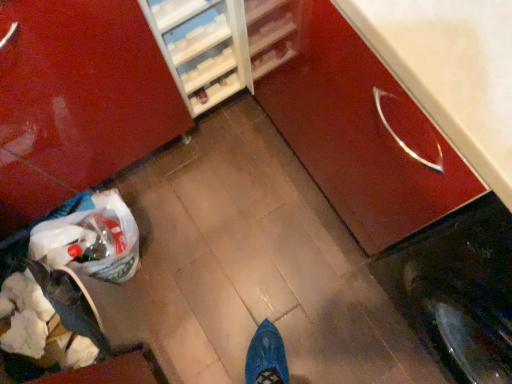
Question: From their relative heights in the image, would you say glossy wood cabinet at lower right, arranged as the first cabinetry when viewed from the left, is taller or shorter than white paper bag at lower left?

Choices:
 (A) tall
 (B) short

Answer: (A)

Question: Looking at their shapes, would you say glossy wood cabinet at lower right, the 2th cabinetry when ordered from right to left, is wider or thinner than white paper bag at lower left?

Choices:
 (A) thin
 (B) wide

Answer: (B)

Question: Which object is the closest to the glossy wood cabinet at center right, arranged as the first cabinetry when viewed from the right?

Choices:
 (A) white paper bag at lower left
 (B) glossy wood cabinet at lower right, arranged as the first cabinetry when viewed from the left

Answer: (B)

Question: Which object is positioned closest to the glossy wood cabinet at lower right, arranged as the first cabinetry when viewed from the left?

Choices:
 (A) glossy wood cabinet at center right, arranged as the first cabinetry when viewed from the right
 (B) white paper bag at lower left

Answer: (B)